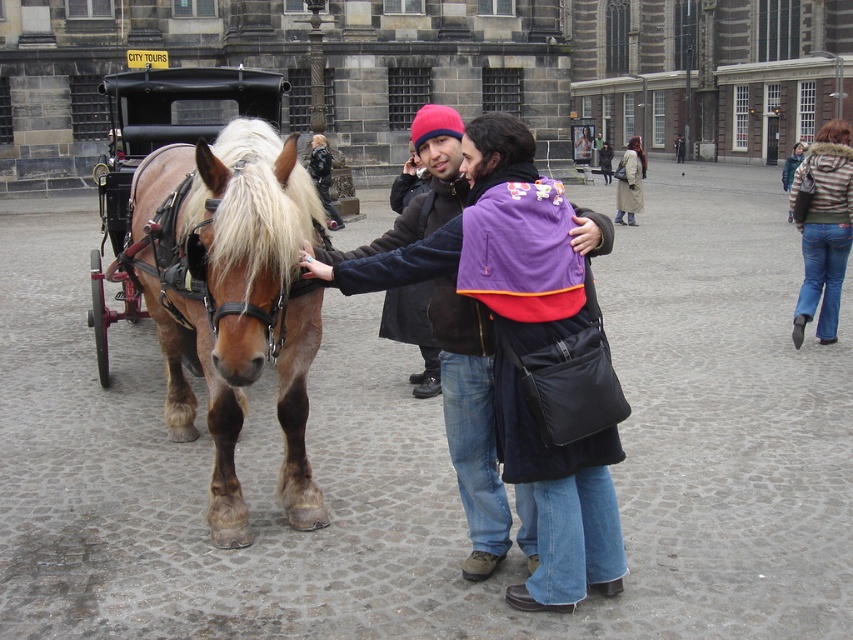
Where is `matte black coat at center`? The image size is (853, 640). matte black coat at center is located at coordinates (469, 417).

Identify the location of matte black coat at center. (469, 417).

Between point (100, 253) and point (631, 176), which one is positioned behind?

The point (631, 176) is behind.

Can you confirm if polished wood cart at left is bigger than light brown leather coat at center?

No, polished wood cart at left is not bigger than light brown leather coat at center.

Between point (128, 212) and point (618, 202), which one is positioned behind?

The point (618, 202) is behind.

Where is `polished wood cart at left`? The width and height of the screenshot is (853, 640). polished wood cart at left is located at coordinates (158, 147).

Which is above, matte black coat at center or striped fleece jacket at right?

striped fleece jacket at right is above.

What do you see at coordinates (469, 417) in the screenshot? The width and height of the screenshot is (853, 640). I see `matte black coat at center` at bounding box center [469, 417].

Describe the element at coordinates (469, 417) in the screenshot. I see `matte black coat at center` at that location.

At what (x,y) coordinates should I click in order to perform the action: click on matte black coat at center. Please return your answer as a coordinate pair (x, y). Looking at the image, I should click on (469, 417).